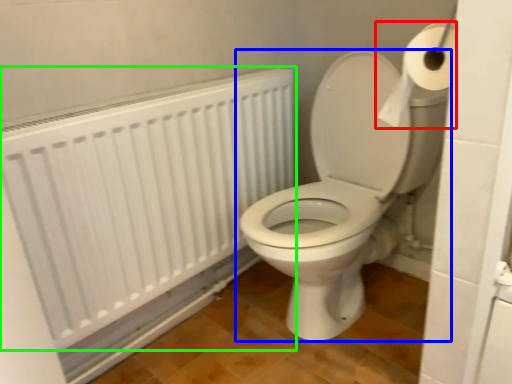
Question: Based on their relative distances, which object is nearer to toilet paper (highlighted by a red box)? Choose from toilet (highlighted by a blue box) and radiator (highlighted by a green box).

Choices:
 (A) toilet
 (B) radiator

Answer: (A)